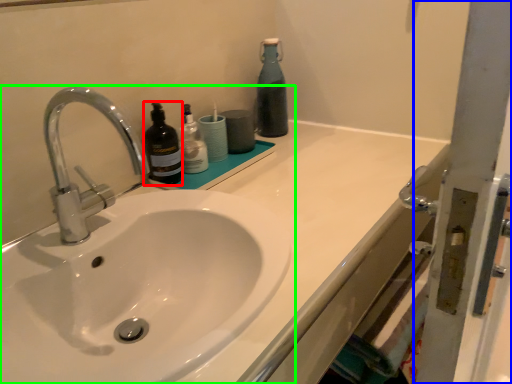
Question: Which object is positioned farthest from bottle (highlighted by a red box)? Select from screen door (highlighted by a blue box) and sink (highlighted by a green box).

Choices:
 (A) screen door
 (B) sink

Answer: (A)